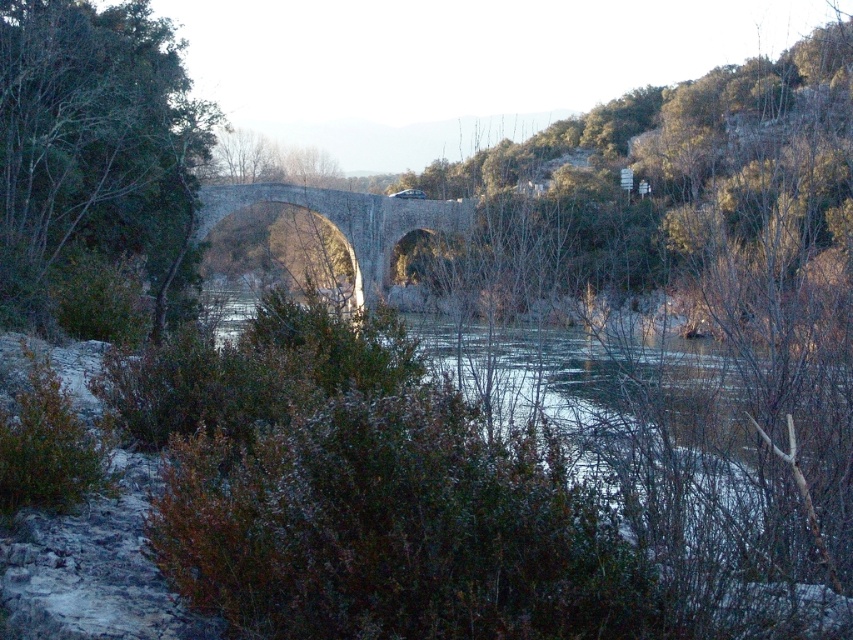
Is point (32, 228) closer to camera compared to point (346, 224)?

That is True.

Image resolution: width=853 pixels, height=640 pixels. Describe the element at coordinates (97, 170) in the screenshot. I see `green leafy tree at center` at that location.

Where is `green leafy tree at center`? This screenshot has height=640, width=853. green leafy tree at center is located at coordinates (97, 170).